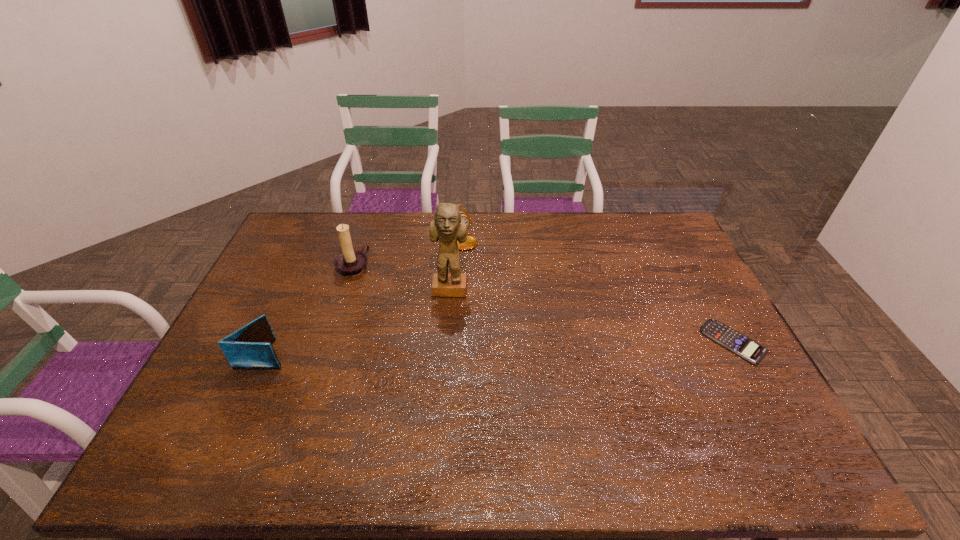
Locate an element on the screen. The width and height of the screenshot is (960, 540). the fourth tallest object is located at coordinates (250, 347).

Identify the location of the leftmost object. (250, 347).

Where is `calculator`? calculator is located at coordinates (736, 342).

The width and height of the screenshot is (960, 540). I want to click on the rightmost object, so click(736, 342).

Find the location of a particular element. This screenshot has width=960, height=540. pocket watch is located at coordinates (471, 242).

Locate an element on the screen. This screenshot has width=960, height=540. the farthest object is located at coordinates (471, 242).

The image size is (960, 540). What are the coordinates of `the second object from left to right` in the screenshot? It's located at (350, 263).

This screenshot has height=540, width=960. What are the coordinates of `candle holder` in the screenshot? It's located at (350, 263).

What are the coordinates of `the tallest object` in the screenshot? It's located at (447, 227).

At what (x,y) coordinates should I click in order to perform the action: click on the third nearest object. Please return your answer as a coordinate pair (x, y). This screenshot has height=540, width=960. Looking at the image, I should click on (447, 227).